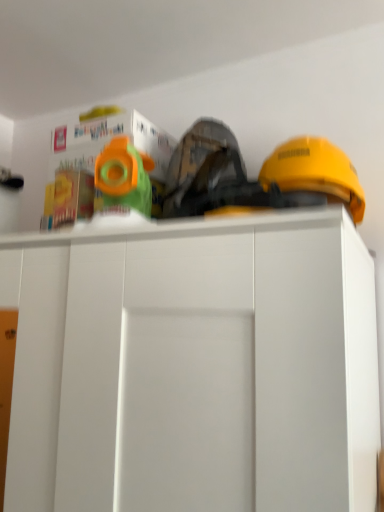
Question: Can you confirm if green plastic toy at upper center, arranged as the second toy when viewed from the left, is taller than matte plastic toy at upper left, the 2th toy in the right-to-left sequence?

Choices:
 (A) yes
 (B) no

Answer: (B)

Question: From a real-world perspective, is green plastic toy at upper center, which ranks as the first toy in right-to-left order, on matte plastic toy at upper left, positioned as the 1th toy in left-to-right order?

Choices:
 (A) yes
 (B) no

Answer: (B)

Question: Does green plastic toy at upper center, arranged as the second toy when viewed from the left, contain matte plastic toy at upper left, positioned as the 1th toy in left-to-right order?

Choices:
 (A) yes
 (B) no

Answer: (B)

Question: Can you confirm if green plastic toy at upper center, which ranks as the first toy in right-to-left order, is positioned to the right of matte plastic toy at upper left, positioned as the 1th toy in left-to-right order?

Choices:
 (A) yes
 (B) no

Answer: (A)

Question: From the image's perspective, would you say green plastic toy at upper center, arranged as the second toy when viewed from the left, is shown under matte plastic toy at upper left, positioned as the 1th toy in left-to-right order?

Choices:
 (A) no
 (B) yes

Answer: (A)

Question: Considering their positions, is yellow hard hat at upper right located in front of or behind white matte cabinet at center?

Choices:
 (A) behind
 (B) front

Answer: (A)

Question: Considering the positions of yellow hard hat at upper right and white matte cabinet at center in the image, is yellow hard hat at upper right taller or shorter than white matte cabinet at center?

Choices:
 (A) short
 (B) tall

Answer: (A)

Question: From a real-world perspective, is yellow hard hat at upper right physically located above or below white matte cabinet at center?

Choices:
 (A) above
 (B) below

Answer: (A)

Question: In terms of size, does yellow hard hat at upper right appear bigger or smaller than white matte cabinet at center?

Choices:
 (A) big
 (B) small

Answer: (B)

Question: Does point (57, 185) appear closer or farther from the camera than point (301, 163)?

Choices:
 (A) farther
 (B) closer

Answer: (A)

Question: Relative to yellow hard hat at upper right, is matte plastic toy at upper left, the 2th toy in the right-to-left sequence, in front or behind?

Choices:
 (A) behind
 (B) front

Answer: (A)

Question: From the image's perspective, relative to yellow hard hat at upper right, is matte plastic toy at upper left, the 2th toy in the right-to-left sequence, above or below?

Choices:
 (A) below
 (B) above

Answer: (A)

Question: Considering the positions of matte plastic toy at upper left, the 2th toy in the right-to-left sequence, and yellow hard hat at upper right in the image, is matte plastic toy at upper left, the 2th toy in the right-to-left sequence, bigger or smaller than yellow hard hat at upper right?

Choices:
 (A) big
 (B) small

Answer: (B)

Question: In terms of size, does white matte cabinet at center appear bigger or smaller than yellow hard hat at upper right?

Choices:
 (A) small
 (B) big

Answer: (B)

Question: Does point (360, 414) appear closer or farther from the camera than point (281, 184)?

Choices:
 (A) farther
 (B) closer

Answer: (B)